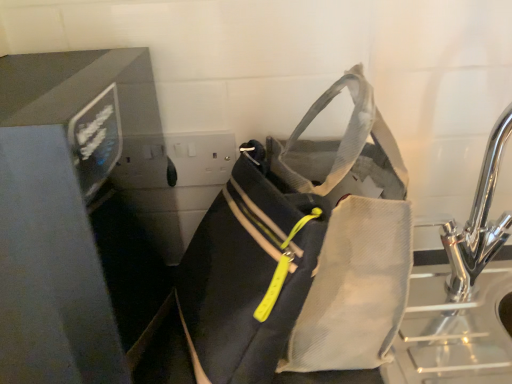
I want to click on matte black monitor at left, so 74,215.

At what (x,y) coordinates should I click in order to perform the action: click on matte black bag at center. Please return your answer as a coordinate pair (x, y). Looking at the image, I should click on (301, 254).

Identify the location of chrome metallic sink at right. This screenshot has height=384, width=512. (461, 296).

Find the location of a particular element. The width and height of the screenshot is (512, 384). luggage and bags on the right of matte black monitor at left is located at coordinates (301, 254).

Is matte black monitor at left turned away from matte black bag at center?

No.

From the image's perspective, between matte black monitor at left and matte black bag at center, which one is located above?

matte black monitor at left.

Could matte black bag at center be considered to be inside chrome metallic sink at right?

No, matte black bag at center is located outside of chrome metallic sink at right.

Considering the sizes of objects chrome metallic sink at right and matte black bag at center in the image provided, who is bigger, chrome metallic sink at right or matte black bag at center?

Bigger between the two is matte black bag at center.

Considering the sizes of objects chrome metallic sink at right and matte black bag at center in the image provided, who is wider, chrome metallic sink at right or matte black bag at center?

Wider between the two is matte black bag at center.

Considering the relative positions of matte black monitor at left and chrome metallic sink at right in the image provided, is matte black monitor at left to the left of chrome metallic sink at right from the viewer's perspective?

Yes.

At what (x,y) coordinates should I click in order to perform the action: click on sink above the matte black monitor at left (from the image's perspective). Please return your answer as a coordinate pair (x, y). This screenshot has height=384, width=512. Looking at the image, I should click on (461, 296).

Can you see matte black monitor at left touching chrome metallic sink at right?

matte black monitor at left and chrome metallic sink at right are clearly separated.

Does point (22, 376) come closer to viewer compared to point (401, 358)?

Yes, it is.

Considering the sizes of objects matte black bag at center and chrome metallic sink at right in the image provided, who is thinner, matte black bag at center or chrome metallic sink at right?

chrome metallic sink at right.

Is matte black bag at center far away from chrome metallic sink at right?

matte black bag at center is near chrome metallic sink at right, not far away.

From the image's perspective, who appears lower, matte black bag at center or chrome metallic sink at right?

matte black bag at center appears lower in the image.

Between matte black bag at center and matte black monitor at left, which one has larger size?

matte black monitor at left.

Could you tell me if matte black bag at center is facing matte black monitor at left?

Yes.

Based on the photo, which object is closer to the camera, matte black bag at center or matte black monitor at left?

Positioned in front is matte black monitor at left.

From the image's perspective, which is below, chrome metallic sink at right or matte black monitor at left?

matte black monitor at left is shown below in the image.

Who is taller, chrome metallic sink at right or matte black monitor at left?

Standing taller between the two is matte black monitor at left.

In terms of width, does chrome metallic sink at right look wider or thinner when compared to matte black monitor at left?

chrome metallic sink at right is thinner than matte black monitor at left.

Is matte black monitor at left inside chrome metallic sink at right?

Definitely not — matte black monitor at left is not inside chrome metallic sink at right.

Locate an element on the screen. The image size is (512, 384). appliance that appears in front of the matte black bag at center is located at coordinates (74, 215).

Where is `luggage and bags below the chrome metallic sink at right (from a real-world perspective)`? Image resolution: width=512 pixels, height=384 pixels. luggage and bags below the chrome metallic sink at right (from a real-world perspective) is located at coordinates (301, 254).

Looking at the image, which one is located closer to matte black monitor at left, chrome metallic sink at right or matte black bag at center?

matte black bag at center is closer to matte black monitor at left.

Which object lies nearer to the anchor point chrome metallic sink at right, matte black monitor at left or matte black bag at center?

matte black bag at center is positioned closer to the anchor chrome metallic sink at right.

When comparing their distances from matte black monitor at left, does matte black bag at center or chrome metallic sink at right seem further?

chrome metallic sink at right is positioned further to the anchor matte black monitor at left.

Looking at the image, which one is located further to matte black bag at center, matte black monitor at left or chrome metallic sink at right?

Among the two, chrome metallic sink at right is located further to matte black bag at center.

Based on their spatial positions, is matte black bag at center or matte black monitor at left closer to chrome metallic sink at right?

matte black bag at center is closer to chrome metallic sink at right.

Looking at the image, which one is located closer to matte black bag at center, chrome metallic sink at right or matte black monitor at left?

matte black monitor at left is positioned closer to the anchor matte black bag at center.

Locate an element on the screen. luggage and bags located between matte black monitor at left and chrome metallic sink at right in the left-right direction is located at coordinates (301, 254).